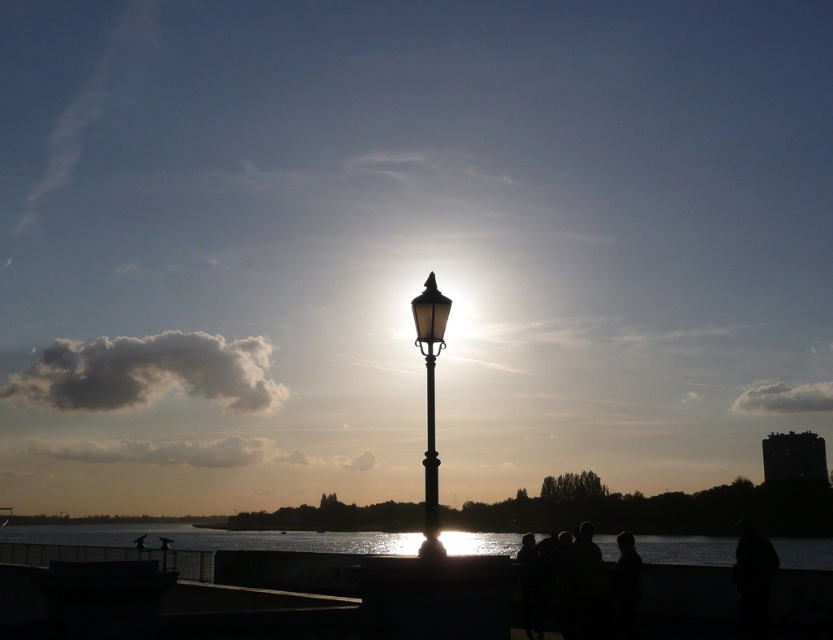
Which is behind, point (609, 540) or point (432, 444)?

Positioned behind is point (609, 540).

The image size is (833, 640). What are the coordinates of `reflective water at lower center` in the screenshot? It's located at pos(217,538).

Can you confirm if reflective water at lower center is thinner than black polished metal streetlight at center?

No, reflective water at lower center is not thinner than black polished metal streetlight at center.

Can you confirm if reflective water at lower center is positioned to the right of black polished metal streetlight at center?

In fact, reflective water at lower center is to the left of black polished metal streetlight at center.

This screenshot has width=833, height=640. What do you see at coordinates (217, 538) in the screenshot? I see `reflective water at lower center` at bounding box center [217, 538].

This screenshot has width=833, height=640. Find the location of `reflective water at lower center`. reflective water at lower center is located at coordinates tap(217, 538).

Can you confirm if black polished metal streetlight at center is wider than metallic pole at center?

Yes.

Is black polished metal streetlight at center positioned before metallic pole at center?

Yes, it is in front of metallic pole at center.

Between point (431, 355) and point (427, 348), which one is positioned in front?

Point (431, 355) is in front.

At what (x,y) coordinates should I click in order to perform the action: click on black polished metal streetlight at center. Please return your answer as a coordinate pair (x, y). The image size is (833, 640). Looking at the image, I should click on (430, 387).